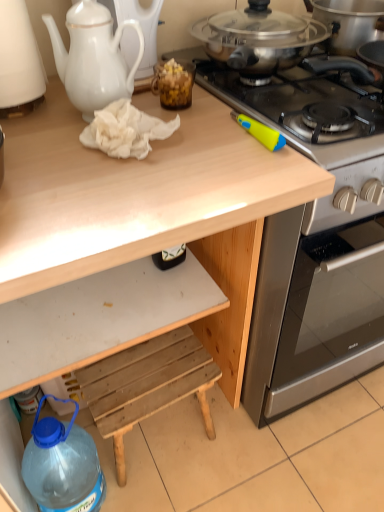
Question: Is white matte drawer at lower center not within wooden step stool at lower center?

Choices:
 (A) no
 (B) yes

Answer: (B)

Question: From the image's perspective, is white matte drawer at lower center located above wooden step stool at lower center?

Choices:
 (A) yes
 (B) no

Answer: (A)

Question: Can you confirm if white matte drawer at lower center is positioned to the left of wooden step stool at lower center?

Choices:
 (A) yes
 (B) no

Answer: (A)

Question: From a real-world perspective, is white matte drawer at lower center below wooden step stool at lower center?

Choices:
 (A) no
 (B) yes

Answer: (A)

Question: Are white matte drawer at lower center and wooden step stool at lower center far apart?

Choices:
 (A) no
 (B) yes

Answer: (A)

Question: Is white ceramic teapot at upper left wider or thinner than white porcelain teapot at upper left?

Choices:
 (A) thin
 (B) wide

Answer: (B)

Question: Is point (29, 103) closer or farther from the camera than point (84, 47)?

Choices:
 (A) closer
 (B) farther

Answer: (B)

Question: Would you say white ceramic teapot at upper left is to the left or to the right of white porcelain teapot at upper left in the picture?

Choices:
 (A) left
 (B) right

Answer: (A)

Question: Relative to white porcelain teapot at upper left, is white ceramic teapot at upper left in front or behind?

Choices:
 (A) front
 (B) behind

Answer: (B)

Question: Considering the positions of white ceramic teapot at upper left and translucent brown jar at upper center in the image, is white ceramic teapot at upper left bigger or smaller than translucent brown jar at upper center?

Choices:
 (A) small
 (B) big

Answer: (B)

Question: Considering the positions of point (1, 54) and point (170, 84), is point (1, 54) closer or farther from the camera than point (170, 84)?

Choices:
 (A) farther
 (B) closer

Answer: (B)

Question: From a real-world perspective, is white ceramic teapot at upper left positioned above or below translucent brown jar at upper center?

Choices:
 (A) above
 (B) below

Answer: (A)

Question: From the image's perspective, is white ceramic teapot at upper left above or below translucent brown jar at upper center?

Choices:
 (A) above
 (B) below

Answer: (A)

Question: Is point (294, 97) positioned closer to the camera than point (13, 29)?

Choices:
 (A) farther
 (B) closer

Answer: (A)

Question: Is stainless steel gas stove at upper right to the left or to the right of white ceramic teapot at upper left in the image?

Choices:
 (A) right
 (B) left

Answer: (A)